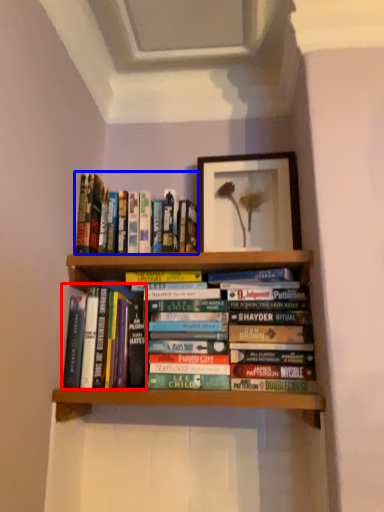
Question: Which of the following is the closest to the observer, book (highlighted by a red box) or book (highlighted by a blue box)?

Choices:
 (A) book
 (B) book

Answer: (A)